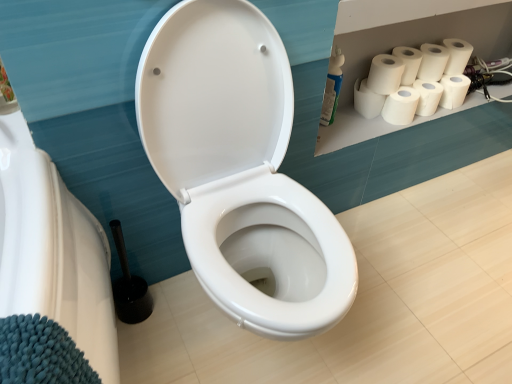
Question: Is white matte paper towel at upper right, which appears as the sixth paper towel when viewed from the right, at the left side of white matte toilet paper at upper right, marked as the second toilet paper in a bottom-to-top arrangement?

Choices:
 (A) no
 (B) yes

Answer: (B)

Question: Is white matte paper towel at upper right, which appears as the sixth paper towel when viewed from the right, surrounding white matte toilet paper at upper right, the first toilet paper when ordered from top to bottom?

Choices:
 (A) yes
 (B) no

Answer: (B)

Question: Can you confirm if white matte paper towel at upper right, acting as the first paper towel starting from the left, is thinner than white matte toilet paper at upper right, the first toilet paper when ordered from top to bottom?

Choices:
 (A) no
 (B) yes

Answer: (A)

Question: Does white matte paper towel at upper right, which appears as the sixth paper towel when viewed from the right, have a greater width compared to white matte toilet paper at upper right, marked as the second toilet paper in a bottom-to-top arrangement?

Choices:
 (A) yes
 (B) no

Answer: (A)

Question: Can you confirm if white matte paper towel at upper right, which appears as the sixth paper towel when viewed from the right, is shorter than white matte toilet paper at upper right, the first toilet paper when ordered from top to bottom?

Choices:
 (A) no
 (B) yes

Answer: (B)

Question: Based on their positions, is white matte paper towel at upper right, marked as the fifth paper towel in a right-to-left arrangement, located to the left or right of white matte paper towel at upper right, placed as the fifth paper towel when sorted from left to right?

Choices:
 (A) right
 (B) left

Answer: (B)

Question: Considering their positions, is white matte paper towel at upper right, which ranks as the second paper towel in left-to-right order, located in front of or behind white matte paper towel at upper right, the second paper towel from the right?

Choices:
 (A) front
 (B) behind

Answer: (A)

Question: Considering the positions of point (385, 84) and point (423, 97), is point (385, 84) closer or farther from the camera than point (423, 97)?

Choices:
 (A) farther
 (B) closer

Answer: (B)

Question: Considering the positions of white matte paper towel at upper right, which ranks as the second paper towel in left-to-right order, and white matte paper towel at upper right, placed as the fifth paper towel when sorted from left to right, in the image, is white matte paper towel at upper right, which ranks as the second paper towel in left-to-right order, taller or shorter than white matte paper towel at upper right, placed as the fifth paper towel when sorted from left to right,?

Choices:
 (A) short
 (B) tall

Answer: (B)

Question: Is white matte paper towel at upper right, the second paper towel from the right, bigger or smaller than white matte toilet paper at upper right, the first toilet paper when ordered from top to bottom?

Choices:
 (A) small
 (B) big

Answer: (A)

Question: From the image's perspective, relative to white matte toilet paper at upper right, marked as the second toilet paper in a bottom-to-top arrangement, is white matte paper towel at upper right, the second paper towel from the right, above or below?

Choices:
 (A) above
 (B) below

Answer: (B)

Question: Do you think white matte paper towel at upper right, placed as the fifth paper towel when sorted from left to right, is within white matte toilet paper at upper right, marked as the second toilet paper in a bottom-to-top arrangement, or outside of it?

Choices:
 (A) outside
 (B) inside

Answer: (A)

Question: Considering their positions, is white matte paper towel at upper right, the second paper towel from the right, located in front of or behind white matte toilet paper at upper right, marked as the second toilet paper in a bottom-to-top arrangement?

Choices:
 (A) behind
 (B) front

Answer: (B)

Question: Is white matte toilet paper at upper right, acting as the second toilet paper starting from the top, spatially inside white matte paper towel at upper right, which appears as the sixth paper towel when viewed from the right, or outside of it?

Choices:
 (A) inside
 (B) outside

Answer: (B)

Question: Is white matte toilet paper at upper right, placed as the 1th toilet paper when sorted from bottom to top, in front of or behind white matte paper towel at upper right, acting as the first paper towel starting from the left, in the image?

Choices:
 (A) front
 (B) behind

Answer: (B)